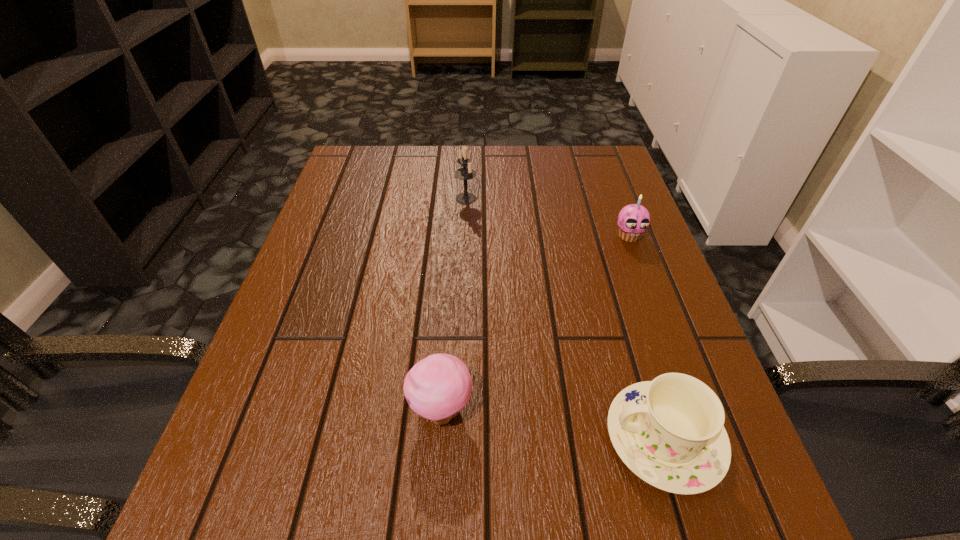
Locate an element on the screen. This screenshot has width=960, height=540. the farthest object is located at coordinates (464, 173).

This screenshot has width=960, height=540. I want to click on the tallest object, so click(464, 173).

Locate an element on the screen. the nearer cupcake is located at coordinates (437, 387).

Locate an element on the screen. This screenshot has height=540, width=960. the farther cupcake is located at coordinates (634, 219).

You are a GUI agent. You are given a task and a screenshot of the screen. Output one action in this format:
    pyautogui.click(x=<x>, y=<y>)
    Task: Click on the right cupcake
    The height and width of the screenshot is (540, 960).
    Given the screenshot: What is the action you would take?
    pyautogui.click(x=634, y=219)

Where is `chinaware`? chinaware is located at coordinates (670, 432).

At what (x,y) coordinates should I click in order to perform the action: click on vacant position located on the left of the tallest object. Please return your answer as a coordinate pair (x, y). The height and width of the screenshot is (540, 960). Looking at the image, I should click on (368, 199).

Where is `free region located on the left of the nearer cupcake`? This screenshot has width=960, height=540. free region located on the left of the nearer cupcake is located at coordinates (283, 410).

Find the location of a particular element. vacant space located 0.300m on the face of the farther cupcake is located at coordinates (675, 358).

The height and width of the screenshot is (540, 960). What are the coordinates of `vacant space located 0.190m on the handle side of the chinaware` in the screenshot? It's located at (481, 438).